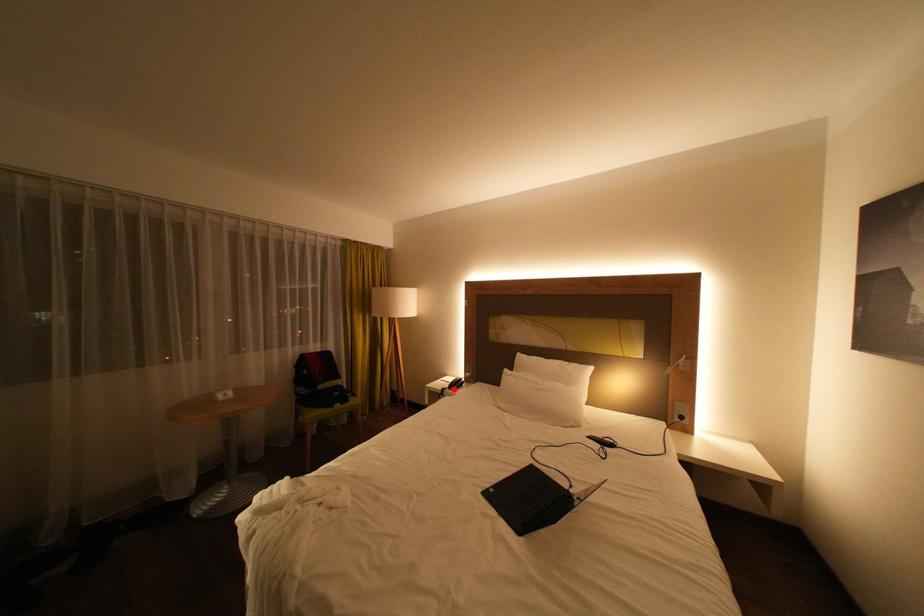
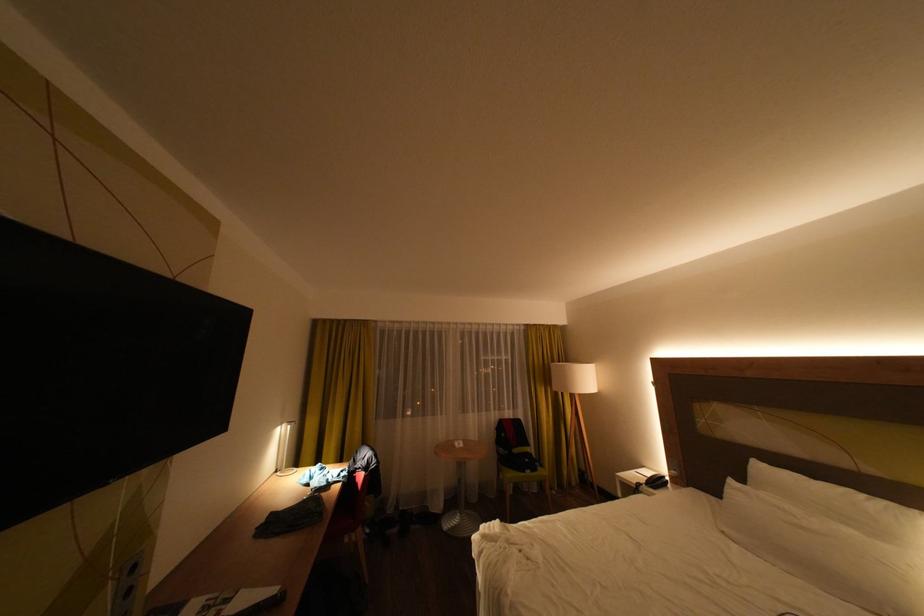
Find the pixel in the second image that matches the highlighted location in the first image.

(649, 484)